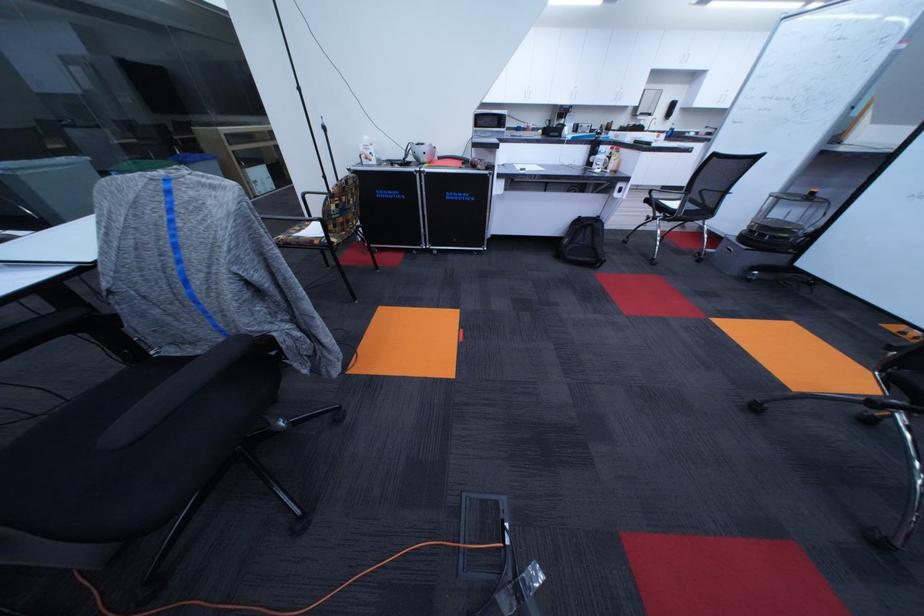
At what (x,y) coordinates should I click in order to perform the action: click on faucet handle. Please return your answer as a coordinate pair (x, y). Image resolution: width=924 pixels, height=616 pixels. Looking at the image, I should click on (652, 132).